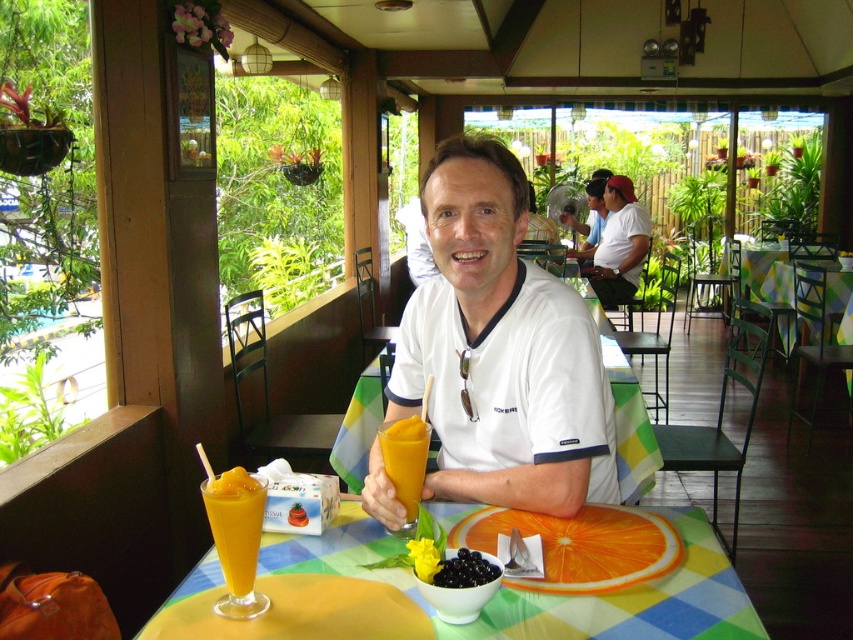
Can you confirm if white smooth shirt at center is wider than translucent glass table at center?

No, white smooth shirt at center is not wider than translucent glass table at center.

Does white smooth shirt at center appear on the right side of translucent glass table at center?

Yes, white smooth shirt at center is to the right of translucent glass table at center.

Where is `white smooth shirt at center`? white smooth shirt at center is located at coordinates (500, 349).

Does white smooth shirt at center have a greater height compared to white cotton shirt at center?

In fact, white smooth shirt at center may be shorter than white cotton shirt at center.

Does white smooth shirt at center have a lesser width compared to white cotton shirt at center?

Yes.

Which is behind, point (589, 470) or point (624, 259)?

The point (624, 259) is more distant.

The height and width of the screenshot is (640, 853). What are the coordinates of `white smooth shirt at center` in the screenshot? It's located at tap(500, 349).

Does point (706, 564) lie behind point (598, 291)?

No, it is not.

Does translucent glass table at center appear on the right side of white cotton shirt at center?

In fact, translucent glass table at center is to the left of white cotton shirt at center.

Is point (303, 600) farther from viewer compared to point (596, 294)?

No, (303, 600) is in front of (596, 294).

The image size is (853, 640). I want to click on translucent glass table at center, so click(x=482, y=609).